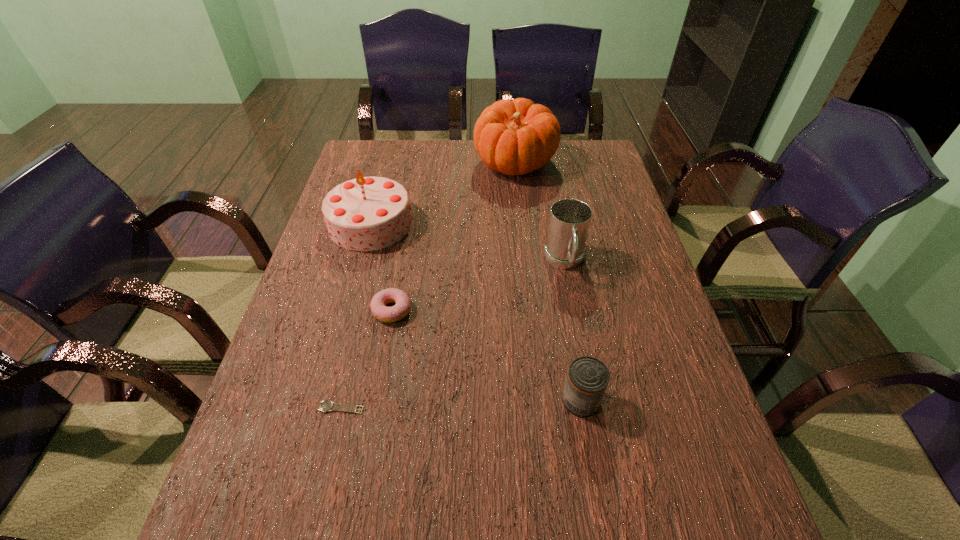
The image size is (960, 540). Find the location of `the farthest object`. the farthest object is located at coordinates (517, 137).

You are a GUI agent. You are given a task and a screenshot of the screen. Output one action in this format:
    pyautogui.click(x=<x>, y=<y>)
    Task: Click on the birthday cake
    The width and height of the screenshot is (960, 540).
    Given the screenshot: What is the action you would take?
    pyautogui.click(x=367, y=213)

The height and width of the screenshot is (540, 960). In order to click on the third tallest object in this screenshot , I will do `click(569, 221)`.

You are a GUI agent. You are given a task and a screenshot of the screen. Output one action in this format:
    pyautogui.click(x=<x>, y=<y>)
    Task: Click on the third shortest object
    
    Given the screenshot: What is the action you would take?
    pyautogui.click(x=587, y=379)

The image size is (960, 540). Find the location of `the fourth farthest object`. the fourth farthest object is located at coordinates (379, 301).

Find the location of a particular element. This screenshot has width=960, height=540. the second shortest object is located at coordinates (379, 301).

Locate an element on the screen. watch is located at coordinates (325, 406).

The height and width of the screenshot is (540, 960). What are the coordinates of `free space located 0.160m on the right of the farthest object` in the screenshot? It's located at (603, 164).

Where is `free region located 0.150m on the back of the birthday cake`? This screenshot has height=540, width=960. free region located 0.150m on the back of the birthday cake is located at coordinates (385, 172).

What are the coordinates of `free space located on the side of the mug with the handle` in the screenshot? It's located at (597, 433).